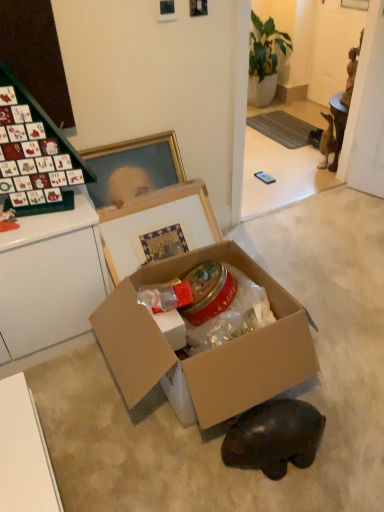
Question: Does cardboard box at center have a smaller size compared to cardboard box at center?

Choices:
 (A) no
 (B) yes

Answer: (A)

Question: From the image's perspective, is cardboard box at center beneath cardboard box at center?

Choices:
 (A) no
 (B) yes

Answer: (B)

Question: Is cardboard box at center not near cardboard box at center?

Choices:
 (A) no
 (B) yes

Answer: (A)

Question: Considering the relative positions of cardboard box at center and cardboard box at center in the image provided, is cardboard box at center in front of cardboard box at center?

Choices:
 (A) no
 (B) yes

Answer: (B)

Question: Is cardboard box at center shorter than cardboard box at center?

Choices:
 (A) yes
 (B) no

Answer: (A)

Question: From the image's perspective, is brown matte figurine at right, which is the 2th animal from left to right, located above or below cardboard box at center?

Choices:
 (A) above
 (B) below

Answer: (A)

Question: Looking at their shapes, would you say brown matte figurine at right, marked as the 1th animal in a top-to-bottom arrangement, is wider or thinner than cardboard box at center?

Choices:
 (A) thin
 (B) wide

Answer: (B)

Question: Is brown matte figurine at right, marked as the 1th animal in a top-to-bottom arrangement, inside the boundaries of cardboard box at center, or outside?

Choices:
 (A) inside
 (B) outside

Answer: (B)

Question: From a real-world perspective, is brown matte figurine at right, marked as the 1th animal in a top-to-bottom arrangement, above or below cardboard box at center?

Choices:
 (A) below
 (B) above

Answer: (A)

Question: From a real-world perspective, is cardboard box at center above or below brown matte figurine at right, the second animal viewed from the front?

Choices:
 (A) below
 (B) above

Answer: (B)

Question: From the image's perspective, is cardboard box at center located above or below brown matte figurine at right, the 1th animal when ordered from back to front?

Choices:
 (A) above
 (B) below

Answer: (B)

Question: Based on their sizes in the image, would you say cardboard box at center is bigger or smaller than brown matte figurine at right, the 1th animal when ordered from back to front?

Choices:
 (A) small
 (B) big

Answer: (B)

Question: In the image, is cardboard box at center on the left side or the right side of brown matte figurine at right, the 2th animal positioned from the bottom?

Choices:
 (A) right
 (B) left

Answer: (B)

Question: In terms of height, does brown matte figurine at right, the second animal viewed from the front, look taller or shorter compared to green glossy plant at upper center?

Choices:
 (A) tall
 (B) short

Answer: (B)

Question: From the image's perspective, is brown matte figurine at right, the second animal viewed from the front, located above or below green glossy plant at upper center?

Choices:
 (A) below
 (B) above

Answer: (A)